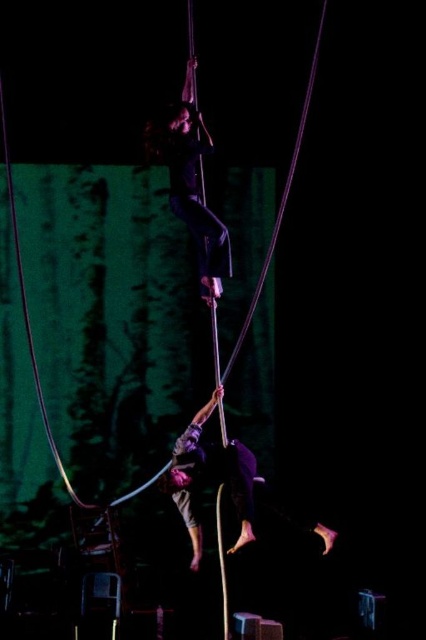
You are a stage designer planning to add a decorative element between the black matte pants at upper center and the smooth blue rope at upper center. Which object should you place closer to the center to ensure the decorative element fits within the narrower space?

The black matte pants at upper center has a smaller width than the smooth blue rope at upper center, so placing the decorative element closer to the black matte pants at upper center ensures it fits within the narrower space.

You are a stage designer assessing the aerial performance setup. You notice the black matte pants at upper center and the dark purple fabric pole at lower center. Which object is located above the other?

The black matte pants at upper center is positioned over the dark purple fabric pole at lower center.

You are a photographer capturing this aerial performance. You want to focus on the two points in the image, point (325, 548) and point (11, 164). Which point is closer to the camera?

Point (325, 548) is in front of point (11, 164), so it is closer to the camera.